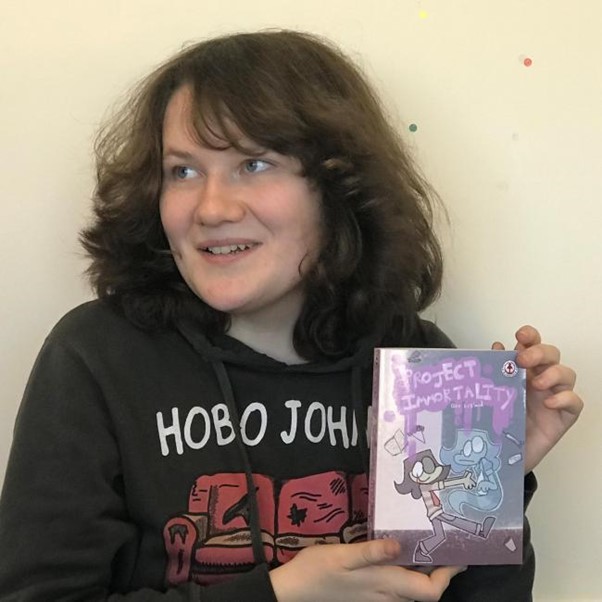
Where is `wall`? wall is located at coordinates (504, 179).